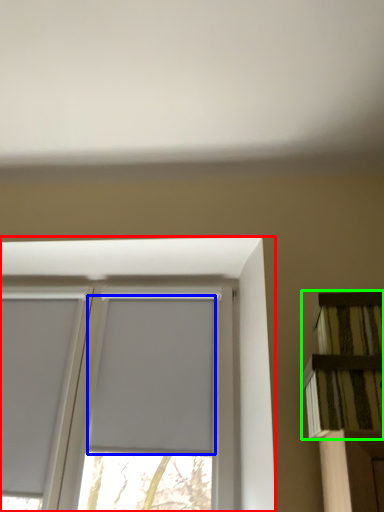
Question: Which object is positioned farthest from window (highlighted by a red box)? Select from window screen (highlighted by a blue box) and shelf (highlighted by a green box).

Choices:
 (A) window screen
 (B) shelf

Answer: (B)